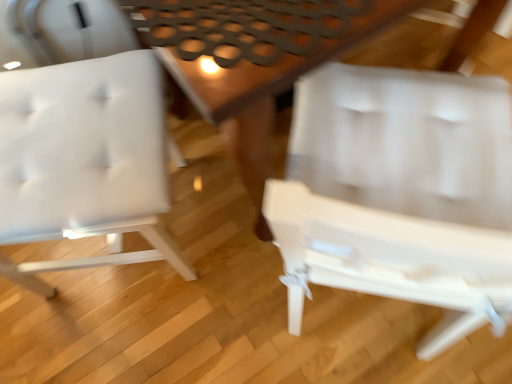
Where is `white matte chair at left, which appears as the 2th chair when viewed from the right`? The height and width of the screenshot is (384, 512). white matte chair at left, which appears as the 2th chair when viewed from the right is located at coordinates (84, 161).

Locate an element on the screen. white plastic chair at center, arranged as the first chair when viewed from the right is located at coordinates click(399, 194).

This screenshot has height=384, width=512. Identify the location of white matte chair at left, which appears as the 2th chair when viewed from the right. (84, 161).

From the image's perspective, which one is positioned higher, wooden table at center or white plastic chair at center, placed as the second chair when sorted from left to right?

wooden table at center, from the image's perspective.

Is point (213, 102) farther from viewer compared to point (284, 249)?

No, (213, 102) is in front of (284, 249).

Which of these two, wooden table at center or white plastic chair at center, arranged as the first chair when viewed from the right, is wider?

wooden table at center is wider.

From the image's perspective, is white plastic chair at center, arranged as the first chair when viewed from the right, positioned above or below white matte chair at left, which appears as the 2th chair when viewed from the right?

Based on their image positions, white plastic chair at center, arranged as the first chair when viewed from the right, is located beneath white matte chair at left, which appears as the 2th chair when viewed from the right.

Based on the photo, how different are the orientations of white plastic chair at center, placed as the second chair when sorted from left to right, and white matte chair at left, positioned as the first chair in left-to-right order, in degrees?

72.5 degrees.

Considering the relative positions of white plastic chair at center, arranged as the first chair when viewed from the right, and white matte chair at left, which appears as the 2th chair when viewed from the right, in the image provided, is white plastic chair at center, arranged as the first chair when viewed from the right, in front of white matte chair at left, which appears as the 2th chair when viewed from the right,?

Yes.

Does point (409, 270) come farther from viewer compared to point (86, 102)?

That is False.

Considering the sizes of white matte chair at left, positioned as the first chair in left-to-right order, and white plastic chair at center, placed as the second chair when sorted from left to right, in the image, is white matte chair at left, positioned as the first chair in left-to-right order, taller or shorter than white plastic chair at center, placed as the second chair when sorted from left to right,?

Clearly, white matte chair at left, positioned as the first chair in left-to-right order, is shorter compared to white plastic chair at center, placed as the second chair when sorted from left to right.

Can white plastic chair at center, arranged as the first chair when viewed from the right, be found inside white matte chair at left, which appears as the 2th chair when viewed from the right?

No.

There is a white matte chair at left, which appears as the 2th chair when viewed from the right. Where is `chair above it (from a real-world perspective)`? This screenshot has height=384, width=512. chair above it (from a real-world perspective) is located at coordinates (399, 194).

Is white matte chair at left, positioned as the first chair in left-to-right order, at the right side of wooden table at center?

In fact, white matte chair at left, positioned as the first chair in left-to-right order, is to the left of wooden table at center.

Can you confirm if white matte chair at left, which appears as the 2th chair when viewed from the right, is wider than wooden table at center?

In fact, white matte chair at left, which appears as the 2th chair when viewed from the right, might be narrower than wooden table at center.

Considering the relative sizes of white matte chair at left, which appears as the 2th chair when viewed from the right, and wooden table at center in the image provided, is white matte chair at left, which appears as the 2th chair when viewed from the right, taller than wooden table at center?

Yes, white matte chair at left, which appears as the 2th chair when viewed from the right, is taller than wooden table at center.

From a real-world perspective, is white matte chair at left, which appears as the 2th chair when viewed from the right, on top of wooden table at center?

Yes, from a real-world perspective, white matte chair at left, which appears as the 2th chair when viewed from the right, is on top of wooden table at center.

Is white plastic chair at center, placed as the second chair when sorted from left to right, not close to wooden table at center?

That's not correct — white plastic chair at center, placed as the second chair when sorted from left to right, is a little close to wooden table at center.

Is white plastic chair at center, placed as the second chair when sorted from left to right, facing towards wooden table at center?

Yes.

Is wooden table at center located within white plastic chair at center, placed as the second chair when sorted from left to right?

Actually, wooden table at center is outside white plastic chair at center, placed as the second chair when sorted from left to right.

Would you say wooden table at center is to the left or to the right of white matte chair at left, which appears as the 2th chair when viewed from the right, in the picture?

Based on their positions, wooden table at center is located to the right of white matte chair at left, which appears as the 2th chair when viewed from the right.

Which is further, [343,38] or [84,158]?

Point [84,158]

Are wooden table at center and white matte chair at left, positioned as the first chair in left-to-right order, beside each other?

There is a gap between wooden table at center and white matte chair at left, positioned as the first chair in left-to-right order.

Could you tell me if wooden table at center is turned towards white matte chair at left, which appears as the 2th chair when viewed from the right?

No, wooden table at center is not turned towards white matte chair at left, which appears as the 2th chair when viewed from the right.

Find the location of a particular element. This screenshot has height=384, width=512. chair that is the 2nd one when counting downward from the wooden table at center (from the image's perspective) is located at coordinates coord(399,194).

Where is `chair in front of the white matte chair at left, which appears as the 2th chair when viewed from the right`? The height and width of the screenshot is (384, 512). chair in front of the white matte chair at left, which appears as the 2th chair when viewed from the right is located at coordinates (399, 194).

When comparing their distances from white plastic chair at center, placed as the second chair when sorted from left to right, does white matte chair at left, positioned as the first chair in left-to-right order, or wooden table at center seem further?

white matte chair at left, positioned as the first chair in left-to-right order, is positioned further to the anchor white plastic chair at center, placed as the second chair when sorted from left to right.

From the image, which object appears to be farther from white matte chair at left, positioned as the first chair in left-to-right order, white plastic chair at center, arranged as the first chair when viewed from the right, or wooden table at center?

white plastic chair at center, arranged as the first chair when viewed from the right, is further to white matte chair at left, positioned as the first chair in left-to-right order.

Looking at the image, which one is located further to wooden table at center, white plastic chair at center, placed as the second chair when sorted from left to right, or white matte chair at left, which appears as the 2th chair when viewed from the right?

white matte chair at left, which appears as the 2th chair when viewed from the right, is further to wooden table at center.

In the scene shown: From the image, which object appears to be farther from wooden table at center, white matte chair at left, positioned as the first chair in left-to-right order, or white plastic chair at center, arranged as the first chair when viewed from the right?

Among the two, white matte chair at left, positioned as the first chair in left-to-right order, is located further to wooden table at center.

Which object lies further to the anchor point white plastic chair at center, placed as the second chair when sorted from left to right, wooden table at center or white matte chair at left, positioned as the first chair in left-to-right order?

Based on the image, white matte chair at left, positioned as the first chair in left-to-right order, appears to be further to white plastic chair at center, placed as the second chair when sorted from left to right.

Based on the photo, from the image, which object appears to be nearer to white matte chair at left, which appears as the 2th chair when viewed from the right, wooden table at center or white plastic chair at center, arranged as the first chair when viewed from the right?

wooden table at center lies closer to white matte chair at left, which appears as the 2th chair when viewed from the right, than the other object.

Where is `table situated between white matte chair at left, positioned as the first chair in left-to-right order, and white plastic chair at center, arranged as the first chair when viewed from the right, from left to right`? table situated between white matte chair at left, positioned as the first chair in left-to-right order, and white plastic chair at center, arranged as the first chair when viewed from the right, from left to right is located at coordinates (253, 60).